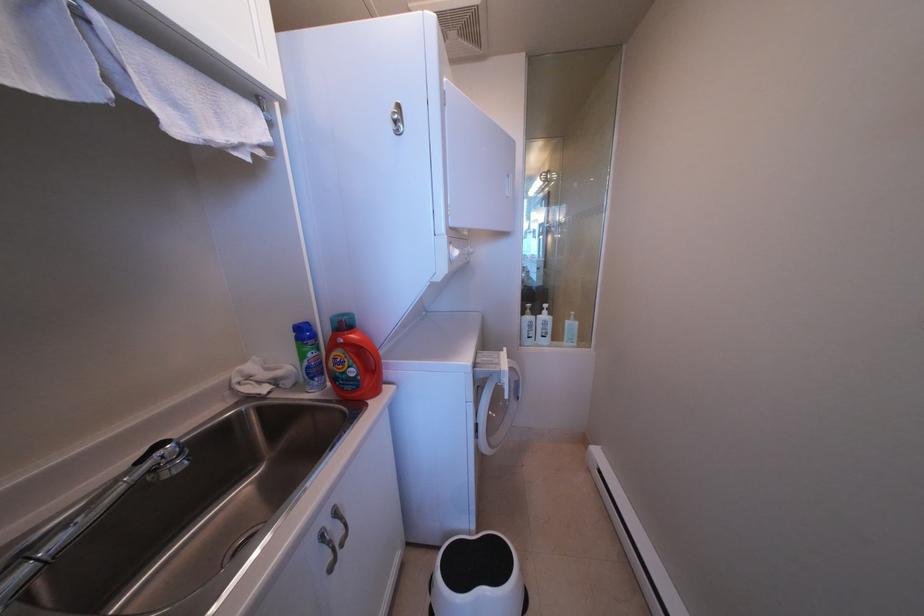
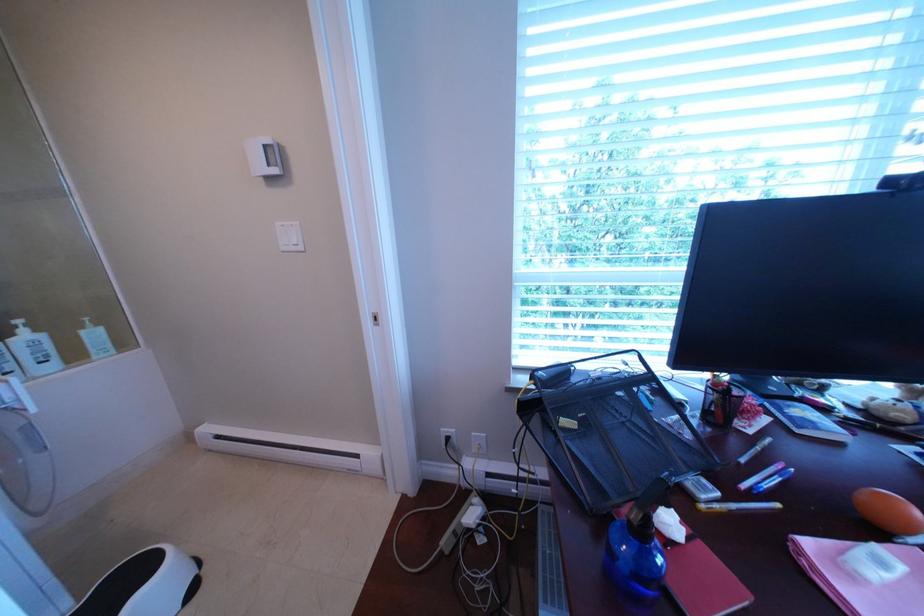
Question: The first image is from the beginning of the video and the second image is from the end. How did the camera likely rotate when shooting the video?

Choices:
 (A) Left
 (B) Right
 (C) Up
 (D) Down

Answer: (B)